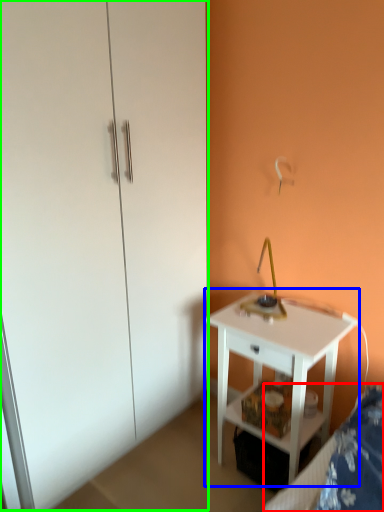
Question: Considering the real-world distances, which object is farthest from bed frame (highlighted by a red box)? nightstand (highlighted by a blue box) or dresser (highlighted by a green box)?

Choices:
 (A) nightstand
 (B) dresser

Answer: (B)